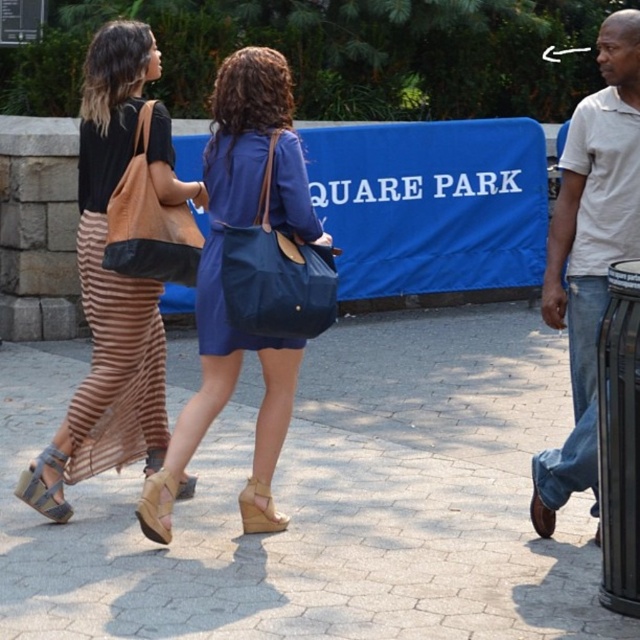
Who is more forward, (x=237, y=243) or (x=124, y=268)?

Point (x=237, y=243) is more forward.

Between blue fabric bag at center and leather tote at left, which one is positioned lower?

blue fabric bag at center

Who is more distant from viewer, (x=304, y=305) or (x=156, y=260)?

Point (x=156, y=260)

You are a GUI agent. You are given a task and a screenshot of the screen. Output one action in this format:
    pyautogui.click(x=<x>, y=<y>)
    Task: Click on the blue fabric bag at center
    The width and height of the screenshot is (640, 640).
    Given the screenshot: What is the action you would take?
    pyautogui.click(x=275, y=272)

Does point (600, 179) lie behind point (141, 253)?

No, it is not.

Can you confirm if white cotton shirt at right is thinner than leather tote at left?

Correct, white cotton shirt at right's width is less than leather tote at left's.

Which is in front, point (605, 163) or point (112, 243)?

Point (605, 163) is in front.

Where is `white cotton shirt at right`? white cotton shirt at right is located at coordinates (589, 252).

Who is shorter, matte blue dress at center or blue fabric bag at center?

blue fabric bag at center

In the scene shown: How much distance is there between matte blue dress at center and blue fabric bag at center?

matte blue dress at center is 7.81 inches away from blue fabric bag at center.

Describe the element at coordinates (221, 285) in the screenshot. I see `matte blue dress at center` at that location.

Identify the location of matte blue dress at center. (221, 285).